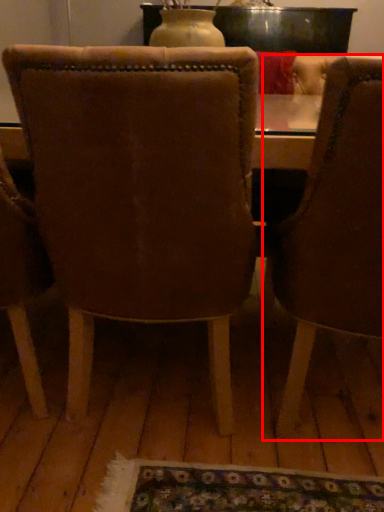
Question: From the image's perspective, what is the correct spatial positioning of chair (annotated by the red box) in reference to chair?

Choices:
 (A) below
 (B) above

Answer: (A)